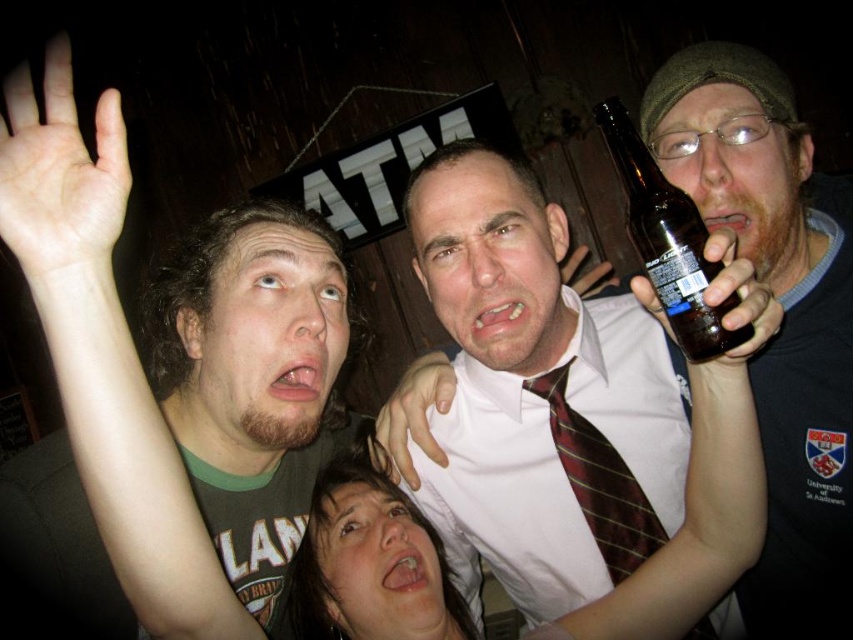
Question: Is matte black shirt at center to the left of smooth skin hand at center from the viewer's perspective?

Choices:
 (A) no
 (B) yes

Answer: (A)

Question: Is maroon striped tie at center smaller than matte black bottle at upper right?

Choices:
 (A) no
 (B) yes

Answer: (B)

Question: Which is farther from the matte black shirt at center?

Choices:
 (A) matte black bottle at upper right
 (B) skinny white hand at upper left

Answer: (B)

Question: Which of the following is the farthest from the observer?

Choices:
 (A) smooth skin hand at center
 (B) matte black shirt at center
 (C) translucent plastic bottle at upper right

Answer: (A)

Question: Does matte black shirt at center appear on the right side of brown glass bottle at right?

Choices:
 (A) yes
 (B) no

Answer: (A)

Question: Estimate the real-world distances between objects in this image. Which object is closer to the maroon striped tie at center?

Choices:
 (A) skinny white hand at upper left
 (B) brown glass bottle at right

Answer: (B)